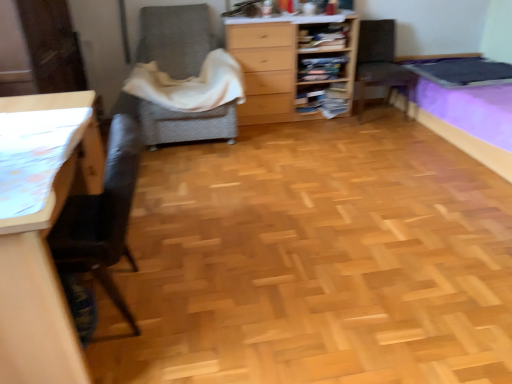
Describe the element at coordinates (284, 68) in the screenshot. I see `wooden chest of drawers at center` at that location.

I want to click on wooden bookshelf at center, the third shelf from the top, so click(x=323, y=99).

Find the location of a particular element. The height and width of the screenshot is (384, 512). purple fabric bed at right is located at coordinates (469, 120).

Image resolution: width=512 pixels, height=384 pixels. What do you see at coordinates (42, 283) in the screenshot?
I see `light brown wood desk at left` at bounding box center [42, 283].

The height and width of the screenshot is (384, 512). I want to click on wooden chest of drawers at center, so coord(284,68).

From the image's perspective, which one is positioned higher, wooden bookshelf at center, marked as the first shelf in a bottom-to-top arrangement, or white soft blanket at center?

white soft blanket at center is shown above in the image.

Which is correct: wooden bookshelf at center, marked as the first shelf in a bottom-to-top arrangement, is inside white soft blanket at center, or outside of it?

wooden bookshelf at center, marked as the first shelf in a bottom-to-top arrangement, is not enclosed by white soft blanket at center.

From their relative heights in the image, would you say wooden bookshelf at center, marked as the first shelf in a bottom-to-top arrangement, is taller or shorter than white soft blanket at center?

In the image, wooden bookshelf at center, marked as the first shelf in a bottom-to-top arrangement, appears to be shorter than white soft blanket at center.

Can you confirm if wooden bookshelf at center, the third shelf from the top, is smaller than white soft blanket at center?

Correct, wooden bookshelf at center, the third shelf from the top, occupies less space than white soft blanket at center.

Is textured gray armchair at center, placed as the first chair when sorted from left to right, with white soft blanket at center?

No, textured gray armchair at center, placed as the first chair when sorted from left to right, is not making contact with white soft blanket at center.

Considering the positions of objects textured gray armchair at center, which is the second chair in right-to-left order, and white soft blanket at center in the image provided, who is behind, textured gray armchair at center, which is the second chair in right-to-left order, or white soft blanket at center?

white soft blanket at center is behind.

Is textured gray armchair at center, placed as the first chair when sorted from left to right, to the right of white soft blanket at center from the viewer's perspective?

In fact, textured gray armchair at center, placed as the first chair when sorted from left to right, is to the left of white soft blanket at center.

Locate an element on the screen. blanket on the right of textured gray armchair at center, placed as the first chair when sorted from left to right is located at coordinates (190, 85).

From the image's perspective, is wooden bookshelf at center, placed as the 2th shelf when sorted from bottom to top, over brown fabric chair at upper right, acting as the first chair starting from the right?

Yes, from the image's perspective, wooden bookshelf at center, placed as the 2th shelf when sorted from bottom to top, is over brown fabric chair at upper right, acting as the first chair starting from the right.

Considering the sizes of objects wooden bookshelf at center, placed as the 2th shelf when sorted from bottom to top, and brown fabric chair at upper right, acting as the first chair starting from the right, in the image provided, who is thinner, wooden bookshelf at center, placed as the 2th shelf when sorted from bottom to top, or brown fabric chair at upper right, acting as the first chair starting from the right,?

wooden bookshelf at center, placed as the 2th shelf when sorted from bottom to top, is thinner.

Considering the relative sizes of wooden bookshelf at center, which is counted as the second shelf, starting from the top, and brown fabric chair at upper right, acting as the first chair starting from the right, in the image provided, is wooden bookshelf at center, which is counted as the second shelf, starting from the top, shorter than brown fabric chair at upper right, acting as the first chair starting from the right,?

Yes, wooden bookshelf at center, which is counted as the second shelf, starting from the top, is shorter than brown fabric chair at upper right, acting as the first chair starting from the right.

Considering the sizes of wooden chest of drawers at center and white soft blanket at center in the image, is wooden chest of drawers at center bigger or smaller than white soft blanket at center?

In the image, wooden chest of drawers at center appears to be larger than white soft blanket at center.

Considering the positions of objects wooden chest of drawers at center and white soft blanket at center in the image provided, who is in front, wooden chest of drawers at center or white soft blanket at center?

white soft blanket at center is in front.

Is wooden chest of drawers at center oriented away from white soft blanket at center?

No, wooden chest of drawers at center is not facing away from white soft blanket at center.

Which is in front, point (331, 23) or point (197, 66)?

Positioned in front is point (197, 66).

Based on the photo, is wooden bookshelf at upper center, the 1th shelf positioned from the top, in front of textured gray armchair at center, placed as the first chair when sorted from left to right?

No, wooden bookshelf at upper center, the 1th shelf positioned from the top, is further to the viewer.

Between wooden bookshelf at upper center, the third shelf from the bottom, and textured gray armchair at center, placed as the first chair when sorted from left to right, which one appears on the right side from the viewer's perspective?

wooden bookshelf at upper center, the third shelf from the bottom, is more to the right.

From the image's perspective, which one is positioned higher, wooden bookshelf at upper center, the 1th shelf positioned from the top, or textured gray armchair at center, which is the second chair in right-to-left order?

wooden bookshelf at upper center, the 1th shelf positioned from the top, is shown above in the image.

From a real-world perspective, between brown fabric chair at upper right, acting as the first chair starting from the right, and white soft blanket at center, who is vertically higher?

white soft blanket at center.

Is brown fabric chair at upper right, acting as the first chair starting from the right, smaller than white soft blanket at center?

Result: No, brown fabric chair at upper right, acting as the first chair starting from the right, is not smaller than white soft blanket at center.

From the image's perspective, between brown fabric chair at upper right, the 2th chair viewed from the left, and white soft blanket at center, who is located below?

From the image's view, white soft blanket at center is below.

Is brown fabric chair at upper right, the 2th chair viewed from the left, aimed at white soft blanket at center?

No, brown fabric chair at upper right, the 2th chair viewed from the left, is not oriented towards white soft blanket at center.

Does light brown wood desk at left have a lesser height compared to white soft blanket at center?

No.

From the image's perspective, is light brown wood desk at left on top of white soft blanket at center?

Incorrect, from the image's perspective, light brown wood desk at left is lower than white soft blanket at center.

Considering the positions of objects light brown wood desk at left and white soft blanket at center in the image provided, who is behind, light brown wood desk at left or white soft blanket at center?

Positioned behind is white soft blanket at center.

Would you say light brown wood desk at left contains white soft blanket at center?

That's incorrect, white soft blanket at center is not inside light brown wood desk at left.

Identify the location of blanket in front of the wooden bookshelf at center, marked as the first shelf in a bottom-to-top arrangement. This screenshot has height=384, width=512. (190, 85).

From the image's perspective, count 1st chairs upward from the white soft blanket at center and point to it. Please provide its 2D coordinates.

[(175, 38)]

Considering their positions, is wooden bookshelf at upper center, the third shelf from the bottom, positioned further to wooden chest of drawers at center than wooden bookshelf at center, the third shelf from the top?

wooden bookshelf at center, the third shelf from the top, is further to wooden chest of drawers at center.

Looking at the image, which one is located further to light brown wood desk at left, wooden bookshelf at upper center, the third shelf from the bottom, or purple fabric bed at right?

purple fabric bed at right.

When comparing their distances from purple fabric bed at right, does wooden bookshelf at center, the third shelf from the top, or wooden bookshelf at center, placed as the 2th shelf when sorted from bottom to top, seem closer?

wooden bookshelf at center, the third shelf from the top, lies closer to purple fabric bed at right than the other object.

Considering their positions, is wooden bookshelf at upper center, the third shelf from the bottom, positioned further to light brown wood desk at left than wooden chest of drawers at center?

wooden bookshelf at upper center, the third shelf from the bottom, is further to light brown wood desk at left.

Looking at the image, which one is located closer to wooden bookshelf at center, the third shelf from the top, purple fabric bed at right or wooden chest of drawers at center?

wooden chest of drawers at center.

In the scene shown: Which object lies nearer to the anchor point wooden bookshelf at upper center, the 1th shelf positioned from the top, wooden bookshelf at center, marked as the first shelf in a bottom-to-top arrangement, or purple fabric bed at right?

Based on the image, wooden bookshelf at center, marked as the first shelf in a bottom-to-top arrangement, appears to be nearer to wooden bookshelf at upper center, the 1th shelf positioned from the top.

Estimate the real-world distances between objects in this image. Which object is closer to brown fabric chair at upper right, acting as the first chair starting from the right, wooden bookshelf at center, placed as the 2th shelf when sorted from bottom to top, or white soft blanket at center?

The object closer to brown fabric chair at upper right, acting as the first chair starting from the right, is wooden bookshelf at center, placed as the 2th shelf when sorted from bottom to top.

Consider the image. When comparing their distances from wooden chest of drawers at center, does wooden bookshelf at center, which is counted as the second shelf, starting from the top, or light brown wood desk at left seem closer?

Among the two, wooden bookshelf at center, which is counted as the second shelf, starting from the top, is located nearer to wooden chest of drawers at center.

Where is `shelf between wooden chest of drawers at center and wooden bookshelf at upper center, the third shelf from the bottom, from left to right`? Image resolution: width=512 pixels, height=384 pixels. shelf between wooden chest of drawers at center and wooden bookshelf at upper center, the third shelf from the bottom, from left to right is located at coordinates (321, 68).

Locate an element on the screen. the chest of drawers situated between white soft blanket at center and purple fabric bed at right from left to right is located at coordinates click(284, 68).

Find the location of a particular element. shelf located between light brown wood desk at left and wooden bookshelf at center, placed as the 2th shelf when sorted from bottom to top, in the depth direction is located at coordinates (323, 37).

Where is `shelf between white soft blanket at center and wooden bookshelf at upper center, the 1th shelf positioned from the top`? The width and height of the screenshot is (512, 384). shelf between white soft blanket at center and wooden bookshelf at upper center, the 1th shelf positioned from the top is located at coordinates (321, 68).